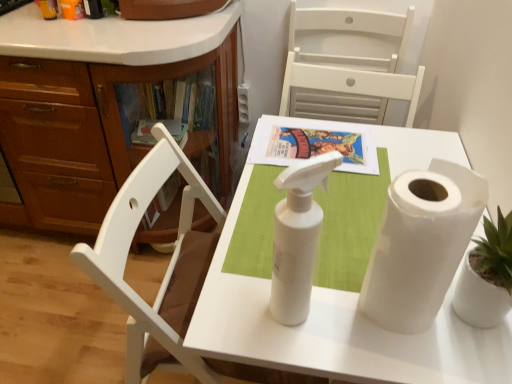
I want to click on vacant area that lies between white paper at right and white matte spray bottle at center, so click(x=347, y=303).